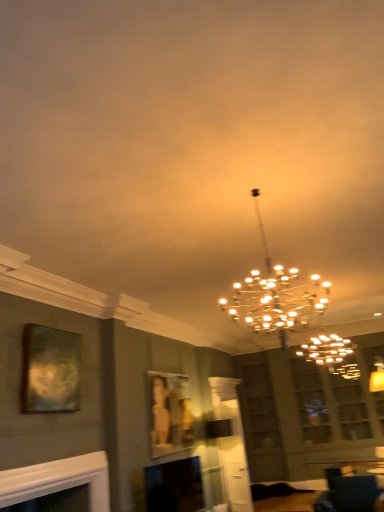
Question: Considering the positions of point (43, 474) and point (367, 502), is point (43, 474) closer or farther from the camera than point (367, 502)?

Choices:
 (A) closer
 (B) farther

Answer: (A)

Question: Looking at the image, does white glossy fireplace at lower left, arranged as the second fireplace when viewed from the right, seem bigger or smaller compared to velvet dark blue sofa at lower right?

Choices:
 (A) small
 (B) big

Answer: (B)

Question: Based on their relative distances, which object is nearer to the matte black fireplace at lower left, which is the second fireplace from front to back?

Choices:
 (A) metallic gold picture frame at upper left, the second picture frame in the bottom-to-top sequence
 (B) metallic gold chandelier at center
 (C) matte gold picture frame at center, which appears as the second picture frame when viewed from the top
 (D) white glossy fireplace at lower left, the second fireplace viewed from the back
 (E) velvet dark blue sofa at lower right

Answer: (C)

Question: Which of these objects is positioned closest to the velvet dark blue sofa at lower right?

Choices:
 (A) metallic gold picture frame at upper left, placed as the 2th picture frame when sorted from back to front
 (B) matte gold picture frame at center, the 2th picture frame from the left
 (C) matte black fireplace at lower left, which is the first fireplace in right-to-left order
 (D) metallic gold chandelier at center
 (E) white glossy fireplace at lower left, arranged as the second fireplace when viewed from the right

Answer: (C)